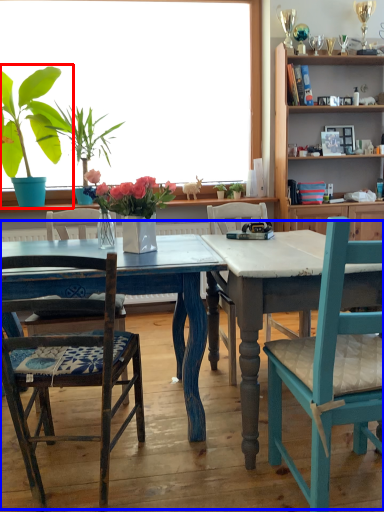
Question: Which of the following is the closest to the observer, houseplant (highlighted by a red box) or kitchen & dining room table (highlighted by a blue box)?

Choices:
 (A) houseplant
 (B) kitchen & dining room table

Answer: (B)